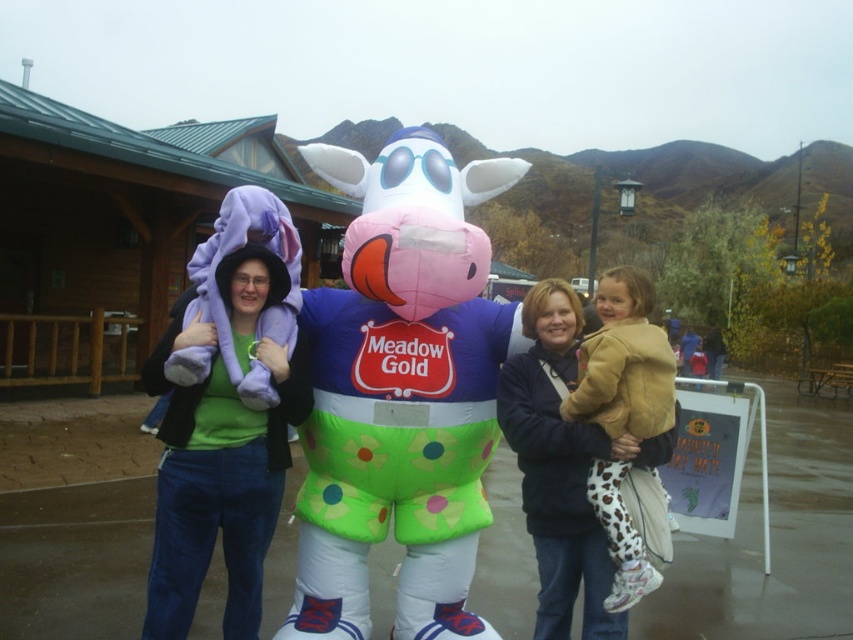
Is point (552, 458) less distant than point (648, 436)?

That is False.

Is matte black jacket at center wider than light brown leather jacket at center?

Yes.

Which is behind, point (616, 627) or point (614, 595)?

The point (616, 627) is behind.

The width and height of the screenshot is (853, 640). I want to click on matte black jacket at center, so click(558, 467).

From the picture: Is matte purple towel at left smaller than light brown leather jacket at center?

Incorrect, matte purple towel at left is not smaller in size than light brown leather jacket at center.

This screenshot has width=853, height=640. Identify the location of matte purple towel at left. (401, 392).

You are a GUI agent. You are given a task and a screenshot of the screen. Output one action in this format:
    pyautogui.click(x=<x>, y=<y>)
    Task: Click on the matte purple towel at left
    
    Given the screenshot: What is the action you would take?
    pyautogui.click(x=401, y=392)

Based on the photo, can you confirm if matte purple towel at left is shorter than inflatable pink and green at center?

Indeed, matte purple towel at left has a lesser height compared to inflatable pink and green at center.

Does matte purple towel at left come behind inflatable pink and green at center?

That is False.

This screenshot has height=640, width=853. Find the location of `matte purple towel at left`. matte purple towel at left is located at coordinates (401, 392).